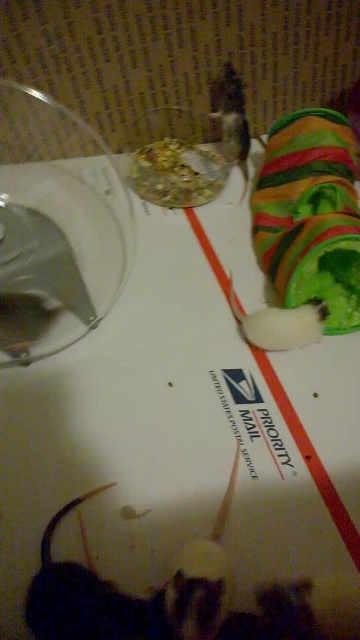
Can you confirm if shiny metallic food at center is smaller than white paper at center?

Yes.

Describe the element at coordinates (177, 172) in the screenshot. I see `shiny metallic food at center` at that location.

Identify the location of shiny metallic food at center. This screenshot has width=360, height=640. (177, 172).